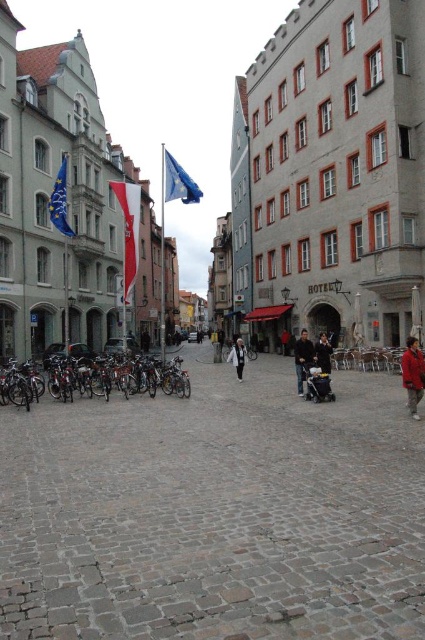
Does point (214, 576) come farther from viewer compared to point (300, 374)?

That is False.

This screenshot has height=640, width=425. I want to click on gray cobblestone square at center, so click(215, 513).

Is blue fabric flag at upper center further to the viewer compared to white cotton jacket at center?

Yes, it is.

Consider the image. How much distance is there between blue fabric flag at upper center and white cotton jacket at center?

blue fabric flag at upper center is 99.87 meters from white cotton jacket at center.

Does point (197, 200) come farther from viewer compared to point (229, 355)?

No, it is in front of (229, 355).

Locate an element on the screen. The height and width of the screenshot is (640, 425). blue fabric flag at upper center is located at coordinates tap(178, 182).

Is point (104, 556) behind point (238, 372)?

That is False.

The height and width of the screenshot is (640, 425). Identify the location of gray cobblestone square at center. (215, 513).

Is point (138, 472) positioned after point (243, 346)?

That is False.

The height and width of the screenshot is (640, 425). Identify the location of gray cobblestone square at center. (215, 513).